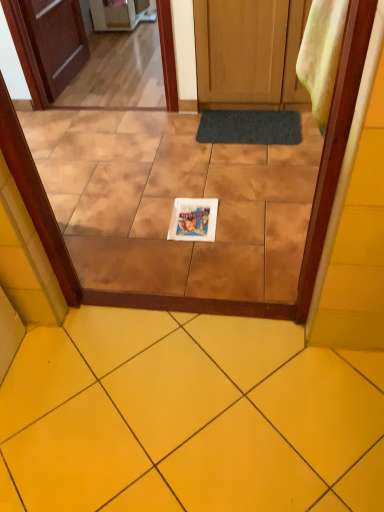
Question: Considering the positions of white glossy magazine at center and dark gray textured mat at center in the image, is white glossy magazine at center taller or shorter than dark gray textured mat at center?

Choices:
 (A) short
 (B) tall

Answer: (A)

Question: Does point (177, 227) appear closer or farther from the camera than point (210, 133)?

Choices:
 (A) closer
 (B) farther

Answer: (A)

Question: Considering the real-world distances, which object is closest to the yellow ceramic tile at center?

Choices:
 (A) dark gray textured mat at center
 (B) white glossy magazine at center

Answer: (B)

Question: Which of these objects is positioned farthest from the white glossy magazine at center?

Choices:
 (A) yellow ceramic tile at center
 (B) dark gray textured mat at center

Answer: (A)